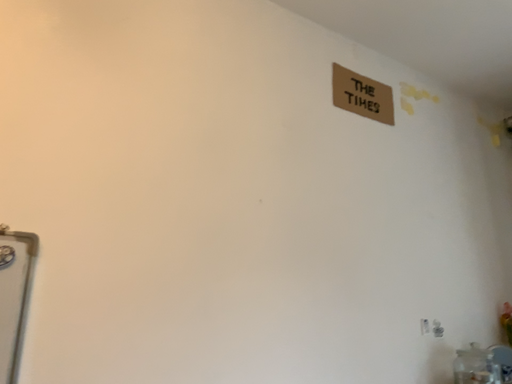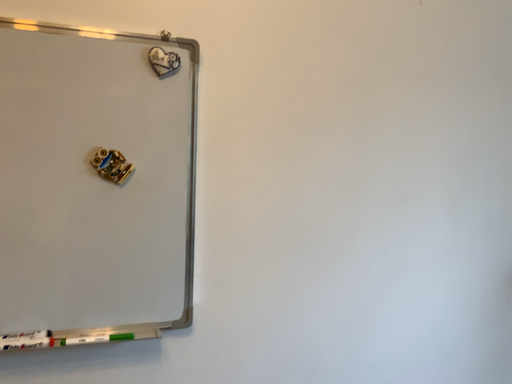
Question: How did the camera likely rotate when shooting the video?

Choices:
 (A) rotated right
 (B) rotated left

Answer: (B)